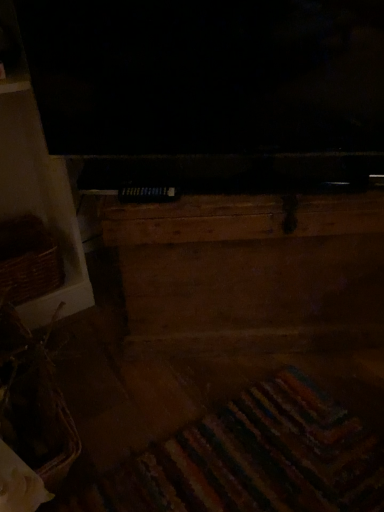
Question: From a real-world perspective, is wooden chest at center physically above brown woven basket at left, which appears as the 1th basket when viewed from the back?

Choices:
 (A) yes
 (B) no

Answer: (A)

Question: Is wooden chest at center at the right side of brown woven basket at left, placed as the second basket when sorted from bottom to top?

Choices:
 (A) no
 (B) yes

Answer: (B)

Question: Can brown woven basket at left, which appears as the 1th basket when viewed from the back, be found inside wooden chest at center?

Choices:
 (A) yes
 (B) no

Answer: (B)

Question: Is wooden chest at center placed right next to brown woven basket at left, which appears as the 1th basket when viewed from the back?

Choices:
 (A) no
 (B) yes

Answer: (A)

Question: Considering the relative positions of wooden chest at center and brown woven basket at left, the second basket positioned from the front, in the image provided, is wooden chest at center to the left of brown woven basket at left, the second basket positioned from the front, from the viewer's perspective?

Choices:
 (A) no
 (B) yes

Answer: (A)

Question: Relative to woven brown basket at lower left, which appears as the 1th basket when viewed from the front, is wooden chest at center in front or behind?

Choices:
 (A) behind
 (B) front

Answer: (A)

Question: In terms of size, does wooden chest at center appear bigger or smaller than woven brown basket at lower left, which appears as the 1th basket when viewed from the front?

Choices:
 (A) small
 (B) big

Answer: (B)

Question: Would you say wooden chest at center is inside or outside woven brown basket at lower left, placed as the 2th basket when sorted from back to front?

Choices:
 (A) outside
 (B) inside

Answer: (A)

Question: From a real-world perspective, is wooden chest at center positioned above or below woven brown basket at lower left, which is the second basket from top to bottom?

Choices:
 (A) above
 (B) below

Answer: (A)

Question: From a real-world perspective, relative to brown woven basket at left, which appears as the 1th basket when viewed from the back, is woven brown basket at lower left, which is the second basket from top to bottom, vertically above or below?

Choices:
 (A) below
 (B) above

Answer: (B)

Question: Is point (26, 460) closer or farther from the camera than point (1, 233)?

Choices:
 (A) farther
 (B) closer

Answer: (B)

Question: Is woven brown basket at lower left, which is the second basket from top to bottom, bigger or smaller than brown woven basket at left, the second basket positioned from the front?

Choices:
 (A) big
 (B) small

Answer: (B)

Question: In terms of height, does woven brown basket at lower left, which appears as the 1th basket when viewed from the front, look taller or shorter compared to brown woven basket at left, the second basket positioned from the front?

Choices:
 (A) tall
 (B) short

Answer: (A)

Question: Considering the relative positions of woven brown basket at lower left, which is the second basket from top to bottom, and wooden chest at center in the image provided, is woven brown basket at lower left, which is the second basket from top to bottom, to the left or to the right of wooden chest at center?

Choices:
 (A) left
 (B) right

Answer: (A)

Question: In terms of height, does woven brown basket at lower left, which is the second basket from top to bottom, look taller or shorter compared to wooden chest at center?

Choices:
 (A) short
 (B) tall

Answer: (A)